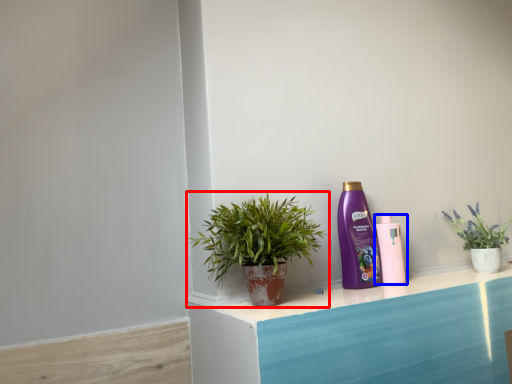
Question: Which point is further to the camera, houseplant (highlighted by a red box) or bottle (highlighted by a blue box)?

Choices:
 (A) houseplant
 (B) bottle

Answer: (B)